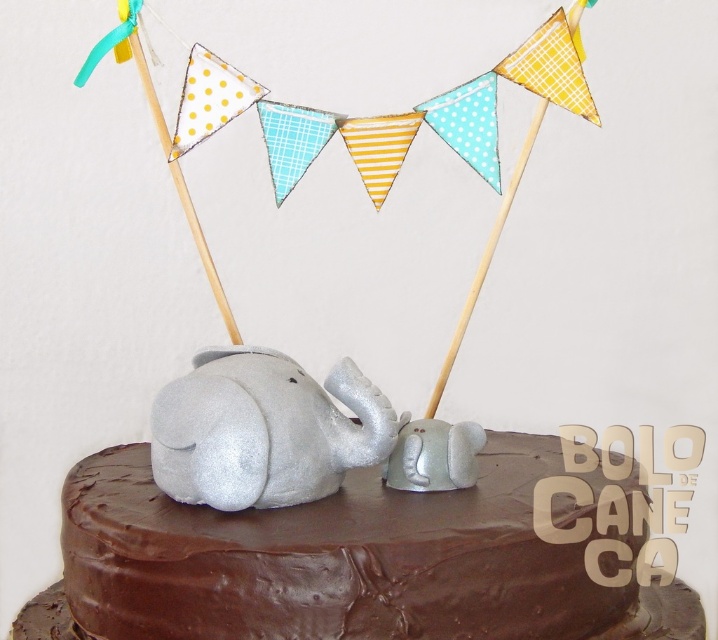
Question: Observing the image, what is the correct spatial positioning of chocolate matte elephant at center in reference to silver glitter baby elephant at center?

Choices:
 (A) left
 (B) right

Answer: (B)

Question: Which point is farther to the camera?

Choices:
 (A) chocolate matte elephant at center
 (B) silver glitter baby elephant at center

Answer: (B)

Question: Is chocolate matte elephant at center above silver glitter baby elephant at center?

Choices:
 (A) yes
 (B) no

Answer: (B)

Question: Is chocolate matte elephant at center further to the viewer compared to silver glitter baby elephant at center?

Choices:
 (A) yes
 (B) no

Answer: (B)

Question: Which point is farther from the camera taking this photo?

Choices:
 (A) (488, 460)
 (B) (185, 435)

Answer: (A)